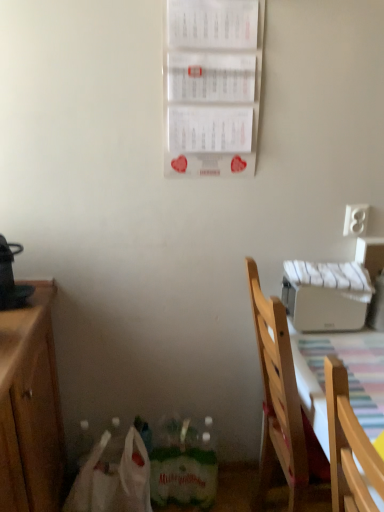
Question: Does white paper calendar at upper center come in front of striped fabric tablecloth at lower right?

Choices:
 (A) yes
 (B) no

Answer: (B)

Question: Is white paper calendar at upper center far away from striped fabric tablecloth at lower right?

Choices:
 (A) no
 (B) yes

Answer: (A)

Question: Is white paper calendar at upper center smaller than striped fabric tablecloth at lower right?

Choices:
 (A) no
 (B) yes

Answer: (B)

Question: Can you see white paper calendar at upper center touching striped fabric tablecloth at lower right?

Choices:
 (A) yes
 (B) no

Answer: (B)

Question: Can you confirm if white paper calendar at upper center is thinner than striped fabric tablecloth at lower right?

Choices:
 (A) yes
 (B) no

Answer: (A)

Question: Considering the positions of striped fabric tablecloth at lower right and white matte printer at upper right in the image, is striped fabric tablecloth at lower right bigger or smaller than white matte printer at upper right?

Choices:
 (A) small
 (B) big

Answer: (B)

Question: From a real-world perspective, is striped fabric tablecloth at lower right above or below white matte printer at upper right?

Choices:
 (A) above
 (B) below

Answer: (B)

Question: Do you think striped fabric tablecloth at lower right is within white matte printer at upper right, or outside of it?

Choices:
 (A) outside
 (B) inside

Answer: (A)

Question: Is striped fabric tablecloth at lower right taller or shorter than white matte printer at upper right?

Choices:
 (A) tall
 (B) short

Answer: (A)

Question: Is white matte printer at upper right wider or thinner than white paper calendar at upper center?

Choices:
 (A) wide
 (B) thin

Answer: (A)

Question: From their relative heights in the image, would you say white matte printer at upper right is taller or shorter than white paper calendar at upper center?

Choices:
 (A) tall
 (B) short

Answer: (B)

Question: From a real-world perspective, is white matte printer at upper right physically located above or below white paper calendar at upper center?

Choices:
 (A) above
 (B) below

Answer: (B)

Question: Considering the relative positions of white matte printer at upper right and white paper calendar at upper center in the image provided, is white matte printer at upper right to the left or to the right of white paper calendar at upper center?

Choices:
 (A) left
 (B) right

Answer: (B)

Question: Is white paper calendar at upper center to the left or to the right of white plastic electric outlet at right in the image?

Choices:
 (A) left
 (B) right

Answer: (A)

Question: Considering the positions of point (203, 33) and point (362, 206), is point (203, 33) closer or farther from the camera than point (362, 206)?

Choices:
 (A) closer
 (B) farther

Answer: (A)